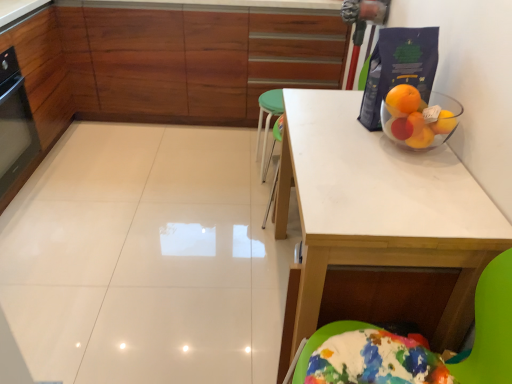
Question: Considering the relative positions of black glass oven at left and white matte table at upper right in the image provided, is black glass oven at left behind white matte table at upper right?

Choices:
 (A) no
 (B) yes

Answer: (B)

Question: Is black glass oven at left to the right of white matte table at upper right from the viewer's perspective?

Choices:
 (A) no
 (B) yes

Answer: (A)

Question: Is black glass oven at left shorter than white matte table at upper right?

Choices:
 (A) no
 (B) yes

Answer: (B)

Question: Considering the relative sizes of black glass oven at left and white matte table at upper right in the image provided, is black glass oven at left smaller than white matte table at upper right?

Choices:
 (A) yes
 (B) no

Answer: (A)

Question: Is black glass oven at left with white matte table at upper right?

Choices:
 (A) no
 (B) yes

Answer: (A)

Question: Does point (22, 135) appear closer or farther from the camera than point (295, 342)?

Choices:
 (A) closer
 (B) farther

Answer: (B)

Question: In terms of width, does black glass oven at left look wider or thinner when compared to white matte table at upper right?

Choices:
 (A) wide
 (B) thin

Answer: (B)

Question: Considering the positions of black glass oven at left and white matte table at upper right in the image, is black glass oven at left taller or shorter than white matte table at upper right?

Choices:
 (A) short
 (B) tall

Answer: (A)

Question: Is black glass oven at left to the left or to the right of white matte table at upper right in the image?

Choices:
 (A) right
 (B) left

Answer: (B)

Question: Is white matte table at upper right situated inside black glass oven at left or outside?

Choices:
 (A) outside
 (B) inside

Answer: (A)

Question: Considering the positions of white matte table at upper right and black glass oven at left in the image, is white matte table at upper right wider or thinner than black glass oven at left?

Choices:
 (A) thin
 (B) wide

Answer: (B)

Question: From their relative heights in the image, would you say white matte table at upper right is taller or shorter than black glass oven at left?

Choices:
 (A) tall
 (B) short

Answer: (A)

Question: Is white matte table at upper right in front of or behind black glass oven at left in the image?

Choices:
 (A) behind
 (B) front

Answer: (B)

Question: Is wooden cabinet at upper center spatially inside white matte table at upper right, or outside of it?

Choices:
 (A) inside
 (B) outside

Answer: (B)

Question: Is point (202, 43) closer or farther from the camera than point (350, 233)?

Choices:
 (A) closer
 (B) farther

Answer: (B)